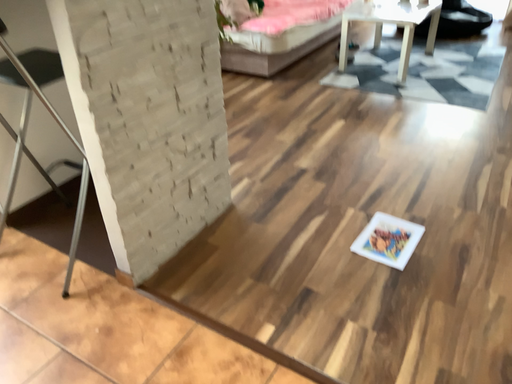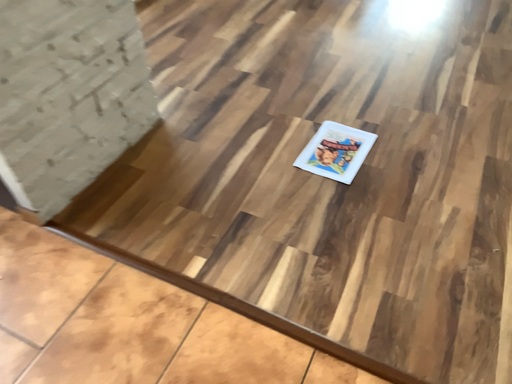
Question: How did the camera likely rotate when shooting the video?

Choices:
 (A) rotated upward
 (B) rotated downward

Answer: (B)